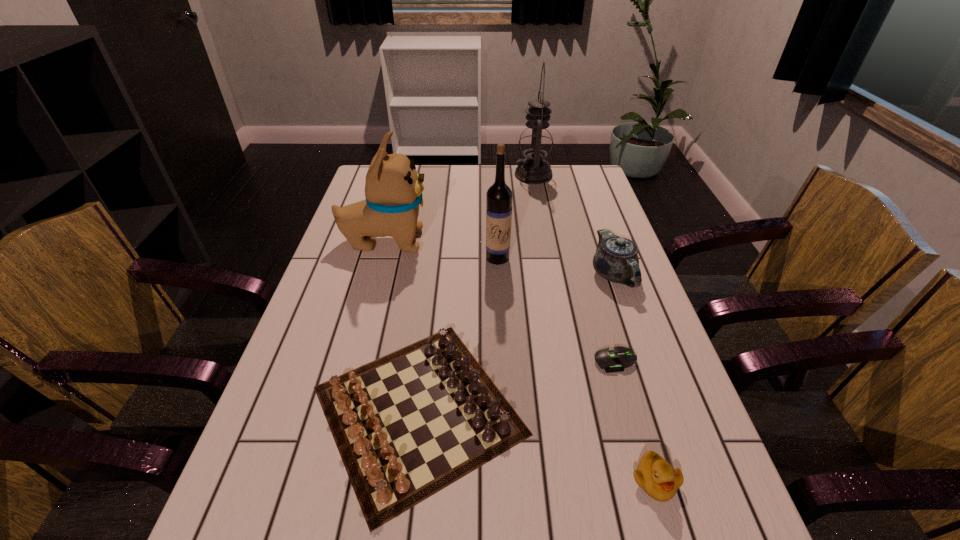
The height and width of the screenshot is (540, 960). I want to click on vacant region located 0.400m from the spout of the chinaware, so click(x=671, y=441).

Find the location of a particular element. Image resolution: width=960 pixels, height=540 pixels. vacant space located on the back of the chessboard is located at coordinates click(x=438, y=248).

Identify the location of vacant space located on the left of the shortest object. (541, 361).

Where is `object located at the far edge`? Image resolution: width=960 pixels, height=540 pixels. object located at the far edge is located at coordinates (536, 140).

You are a GUI agent. You are given a task and a screenshot of the screen. Output one action in this format:
    pyautogui.click(x=<x>, y=<y>)
    Task: Click on the puppy positioned at the left edge
    This screenshot has height=540, width=960.
    Given the screenshot: What is the action you would take?
    pyautogui.click(x=393, y=189)

Identify the location of chessboard at the left edge. The height and width of the screenshot is (540, 960). (407, 425).

Image resolution: width=960 pixels, height=540 pixels. I want to click on oil lamp situated at the right edge, so click(x=536, y=140).

Find the location of a particular element. chinaware that is at the right edge is located at coordinates (616, 259).

Where is `duckling at the right edge`? Image resolution: width=960 pixels, height=540 pixels. duckling at the right edge is located at coordinates (654, 475).

I want to click on computer mouse present at the right edge, so click(x=611, y=360).